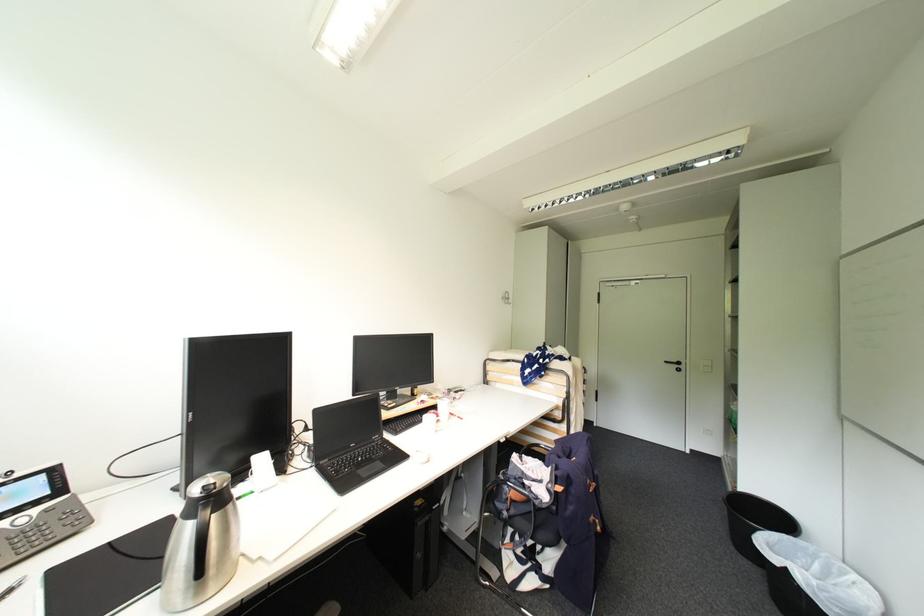
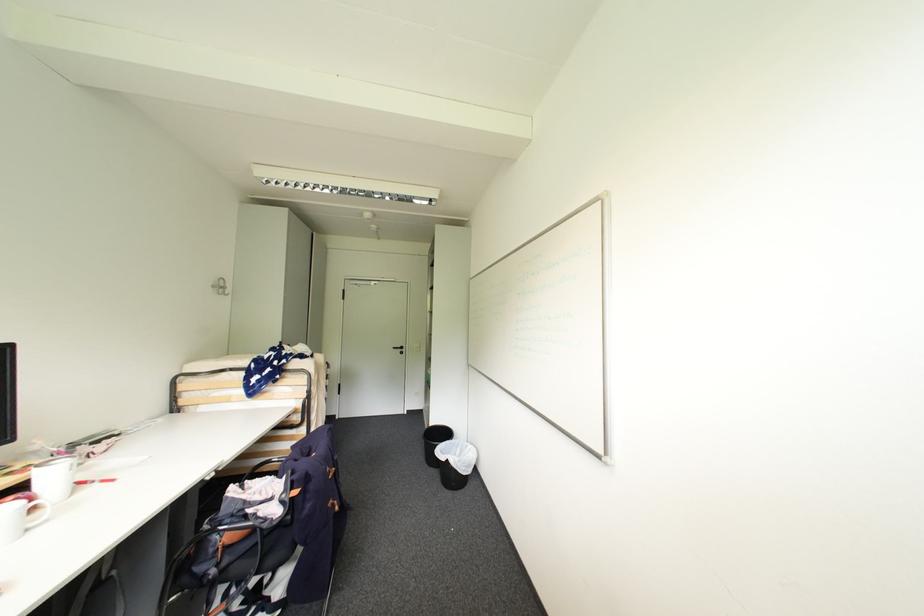
Locate, in the second image, the point that corresponds to [444,422] in the first image.

(41, 509)